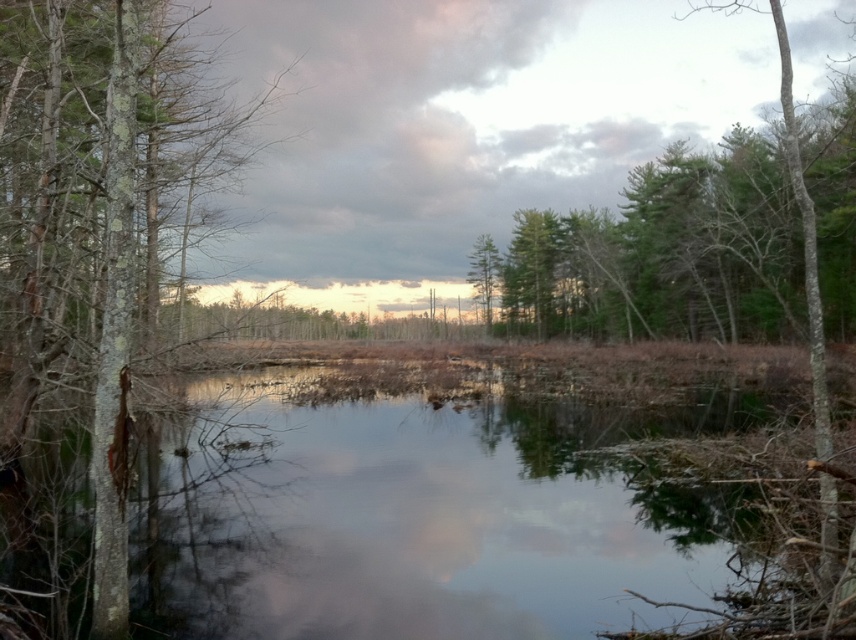
Which is behind, point (70, 1) or point (846, 193)?

The point (846, 193) is more distant.

Does smooth bark tree at left have a smaller size compared to green textured tree at upper center?

Yes, smooth bark tree at left is smaller than green textured tree at upper center.

Identify the location of smooth bark tree at left. The width and height of the screenshot is (856, 640). (93, 214).

I want to click on smooth bark tree at left, so click(93, 214).

Which is behind, point (107, 108) or point (477, 240)?

Point (477, 240)

You are a GUI agent. You are given a task and a screenshot of the screen. Output one action in this format:
    pyautogui.click(x=<x>, y=<y>)
    Task: Click on the smooth bark tree at left
    The image size is (856, 640).
    Given the screenshot: What is the action you would take?
    [93, 214]

Can you confirm if green textured tree at upper center is positioned below green leafy tree at center?

Actually, green textured tree at upper center is above green leafy tree at center.

Locate an element on the screen. This screenshot has width=856, height=640. green textured tree at upper center is located at coordinates (669, 252).